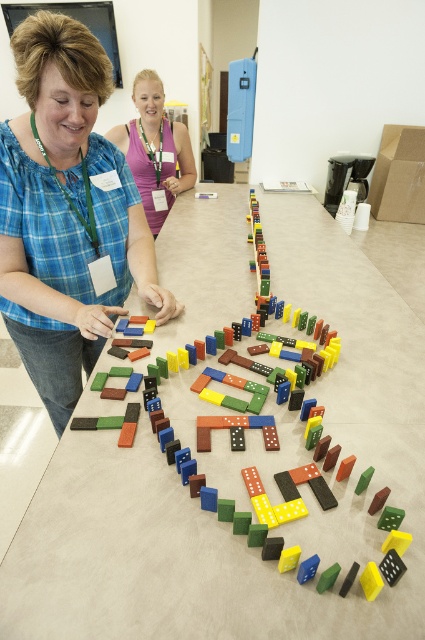
What are the coordinates of the wooden dominoes at center?

The wooden dominoes at center are located at coordinates point (215,515).

You are standing at the end of the table where the wooden dominoes at center are placed. You need to reach the matte purple tank top at upper center to retrieve a badge. Can you reach it without moving the dominoes?

The wooden dominoes at center are much taller than the matte purple tank top at upper center, so they might block your view or access. You might need to move some dominoes to reach the matte purple tank top at upper center.

You are a photographer positioned behind the person in the blue plaid shirt and jeans. You want to capture a clear shot of the wooden dominoes at center and the matte purple tank top at upper center. Which object will appear larger in your photo?

The wooden dominoes at center will appear larger in the photo because they are closer to the viewer than the matte purple tank top at upper center.